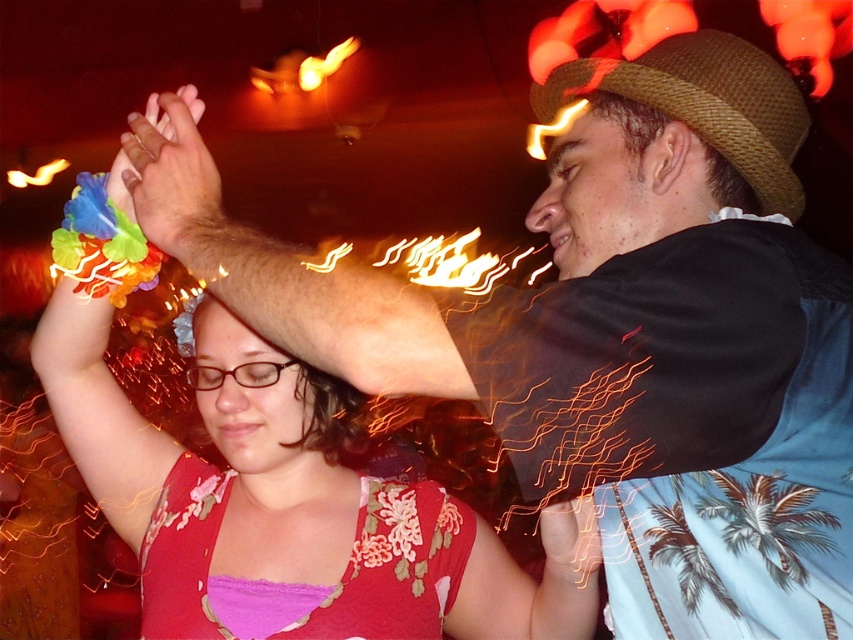
Who is taller, embroidered silk dress at center or matte floral bracelet at upper left?

matte floral bracelet at upper left

Does embroidered silk dress at center lie behind matte floral bracelet at upper left?

Yes, it is behind matte floral bracelet at upper left.

Who is more forward, (x=402, y=586) or (x=180, y=90)?

Point (x=180, y=90) is in front.

The width and height of the screenshot is (853, 640). Identify the location of embroidered silk dress at center. (305, 584).

Measure the distance between floral fabric dress at center and camera.

A distance of 1.03 meters exists between floral fabric dress at center and camera.

Is floral fabric dress at center thinner than embroidered silk dress at center?

No.

Which is behind, point (201, 406) or point (195, 484)?

The point (195, 484) is behind.

What are the coordinates of `floral fabric dress at center` in the screenshot? It's located at (270, 461).

Which of these two, brown straw hat at upper right or matte floral bracelet at upper left, stands shorter?

brown straw hat at upper right

Is brown straw hat at upper right positioned before matte floral bracelet at upper left?

No, it is not.

Locate an element on the screen. The image size is (853, 640). brown straw hat at upper right is located at coordinates (704, 104).

The width and height of the screenshot is (853, 640). In order to click on brown straw hat at upper right in this screenshot , I will do `click(704, 104)`.